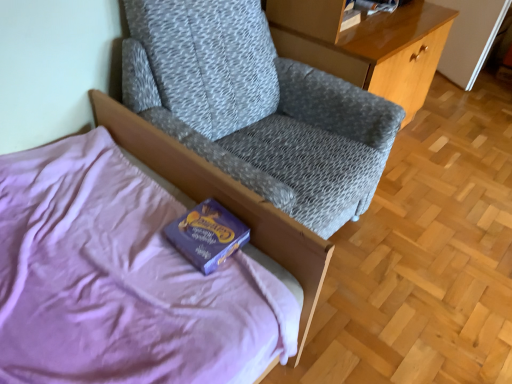
Question: Is wooden glossy desk at upper right behind textured gray fabric chair at upper center?

Choices:
 (A) yes
 (B) no

Answer: (A)

Question: Is wooden glossy desk at upper right smaller than textured gray fabric chair at upper center?

Choices:
 (A) no
 (B) yes

Answer: (B)

Question: Is textured gray fabric chair at upper center a part of wooden glossy desk at upper right?

Choices:
 (A) no
 (B) yes

Answer: (A)

Question: From a real-world perspective, is wooden glossy desk at upper right located beneath textured gray fabric chair at upper center?

Choices:
 (A) yes
 (B) no

Answer: (A)

Question: Considering the relative sizes of wooden glossy desk at upper right and textured gray fabric chair at upper center in the image provided, is wooden glossy desk at upper right shorter than textured gray fabric chair at upper center?

Choices:
 (A) yes
 (B) no

Answer: (A)

Question: Relative to purple soft bed at lower left, is textured gray fabric chair at upper center in front or behind?

Choices:
 (A) front
 (B) behind

Answer: (B)

Question: Looking at the image, does textured gray fabric chair at upper center seem bigger or smaller compared to purple soft bed at lower left?

Choices:
 (A) small
 (B) big

Answer: (B)

Question: Considering the positions of textured gray fabric chair at upper center and purple soft bed at lower left in the image, is textured gray fabric chair at upper center wider or thinner than purple soft bed at lower left?

Choices:
 (A) wide
 (B) thin

Answer: (B)

Question: From the image's perspective, is textured gray fabric chair at upper center above or below purple soft bed at lower left?

Choices:
 (A) below
 (B) above

Answer: (B)

Question: In terms of height, does textured gray fabric chair at upper center look taller or shorter compared to wooden glossy desk at upper right?

Choices:
 (A) short
 (B) tall

Answer: (B)

Question: In terms of size, does textured gray fabric chair at upper center appear bigger or smaller than wooden glossy desk at upper right?

Choices:
 (A) big
 (B) small

Answer: (A)

Question: From a real-world perspective, is textured gray fabric chair at upper center above or below wooden glossy desk at upper right?

Choices:
 (A) below
 (B) above

Answer: (B)

Question: From the image's perspective, is textured gray fabric chair at upper center above or below wooden glossy desk at upper right?

Choices:
 (A) above
 (B) below

Answer: (B)

Question: Is point (201, 203) positioned closer to the camera than point (195, 16)?

Choices:
 (A) closer
 (B) farther

Answer: (A)

Question: In terms of height, does purple matte paperback book at lower left look taller or shorter compared to textured gray fabric chair at upper center?

Choices:
 (A) tall
 (B) short

Answer: (B)